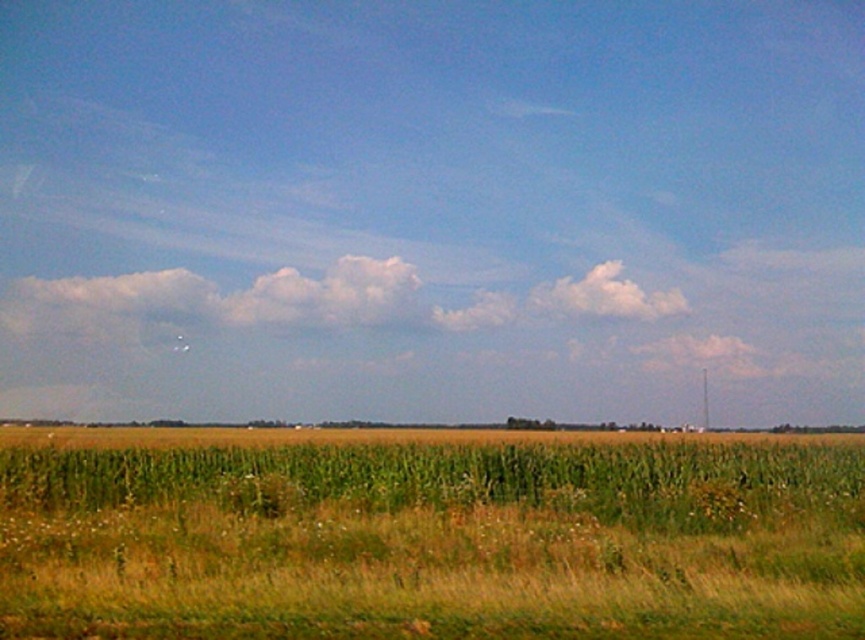
In the scene shown: You are a farmer planning to plant a new crop. You observe the green grassy wheat field at center and the white fluffy cloud at center. Which of these two has a greater width in the image?

The green grassy wheat field at center has a greater width than the white fluffy cloud at center.

You are a farmer standing at the point marked by point (428, 536). You want to check the health of your crops. Which direction should you walk to reach the green grassy wheat field at center?

The point (428, 536) already marks the green grassy wheat field at center, so you are already there.